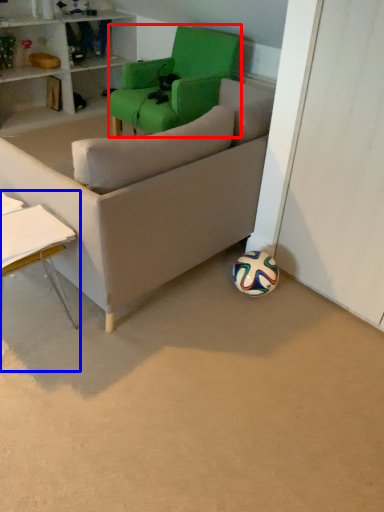
Question: Which of the following is the closest to the observer, chair (highlighted by a red box) or table (highlighted by a blue box)?

Choices:
 (A) chair
 (B) table

Answer: (B)